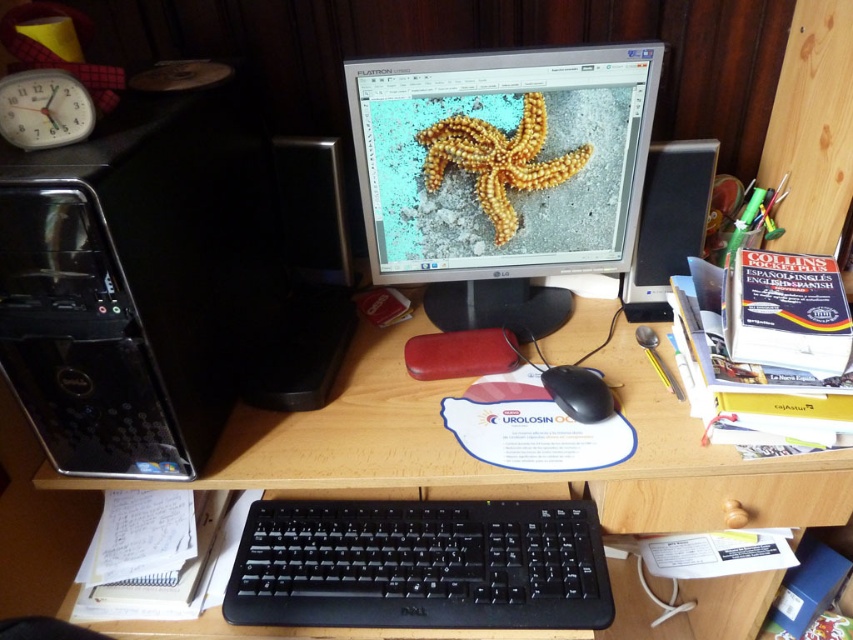
You are setting up a new desk and want to place a wireless charger between the black plastic computer tower at left and the black plastic speaker at left. The wireless charger requires at least 6 inches of space to function properly. Based on the image, will there be enough space between them for the wireless charger?

The black plastic computer tower at left is 6.62 inches away from the black plastic speaker at left. Since the required space is 6 inches, the distance is sufficient for the wireless charger to function properly.

You are setting up a new camera for a live stream and need to place it on the desk. The camera requires at least 25 inches of space between it and the black plastic computer tower at left to avoid interference. Based on the current setup, can you safely place the camera on the desk without violating this requirement?

The black plastic computer tower at left and camera are 25.81 inches apart, which is just over the required 25 inches. Therefore, the camera can be placed safely as the distance meets the requirement.